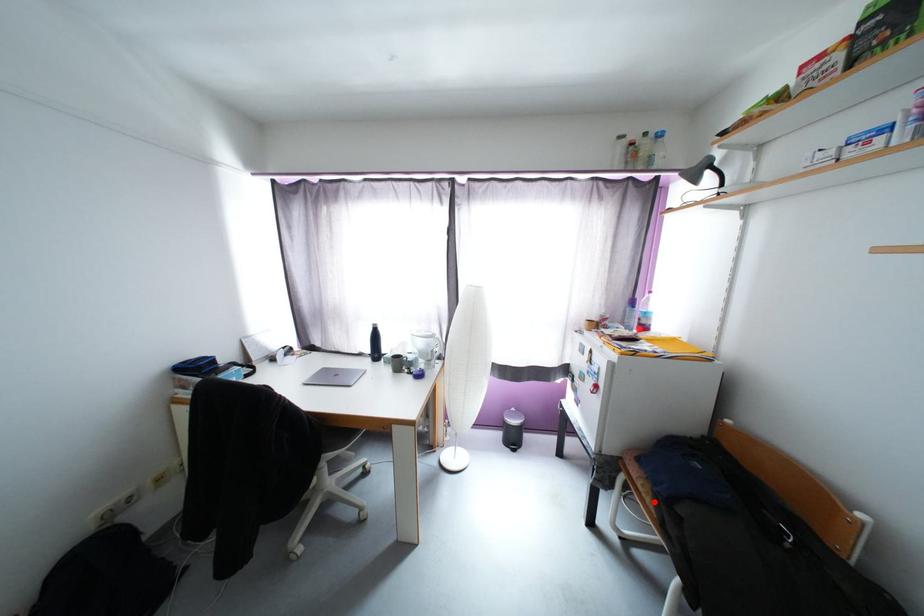
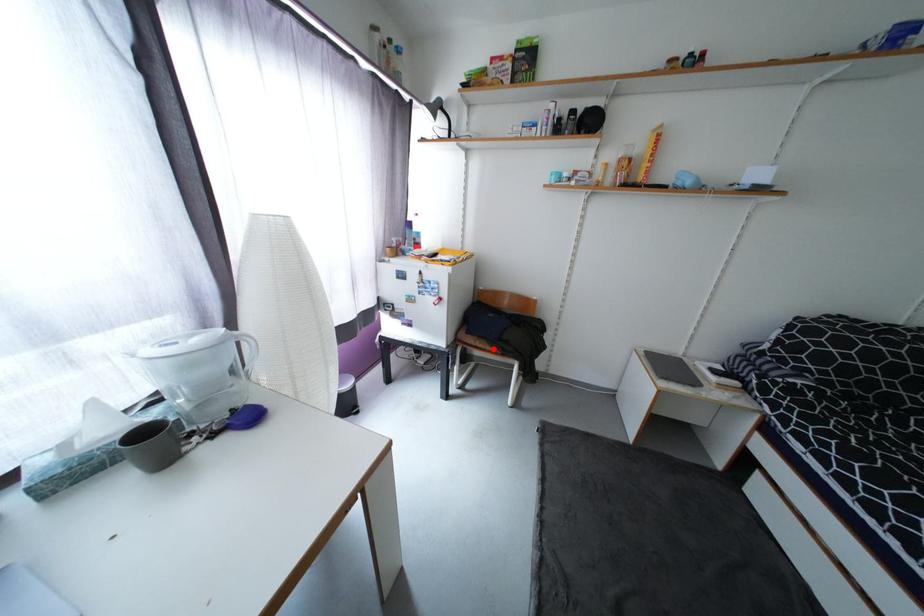
I am providing you with two images of the same scene from different viewpoints. A red point is marked on the first image and another point is marked on the second image. Does the point marked in image1 correspond to the same location as the one in image2?

Yes